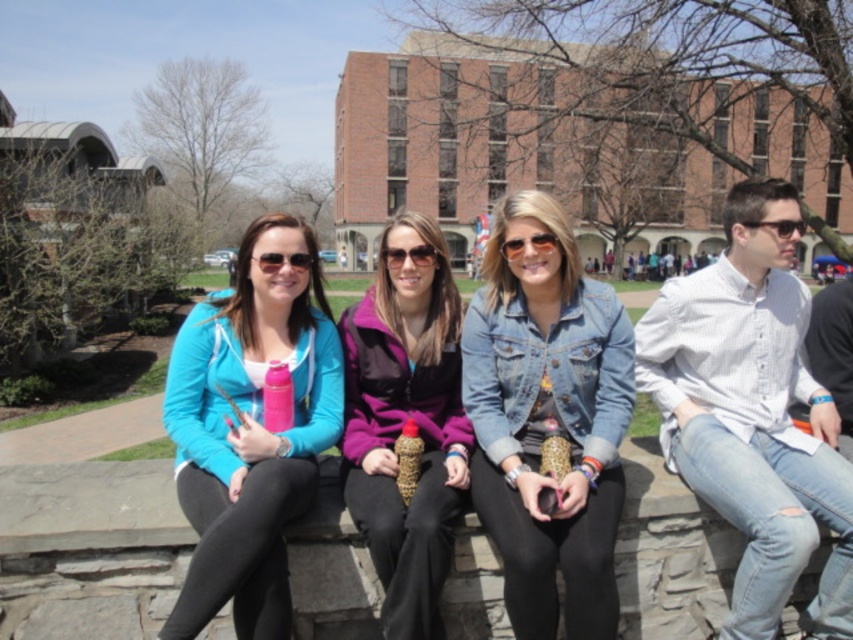
Question: Is denim jacket at center to the right of matte purple sunglasses at center from the viewer's perspective?

Choices:
 (A) yes
 (B) no

Answer: (A)

Question: Which object is positioned farthest from the white striped shirt at right?

Choices:
 (A) denim jacket at center
 (B) matte purple sunglasses at center

Answer: (B)

Question: Which of the following is the closest to the observer?

Choices:
 (A) matte purple sunglasses at center
 (B) purple fleece jacket at center
 (C) white striped shirt at right

Answer: (C)

Question: Which of the following is the closest to the observer?

Choices:
 (A) denim jacket at center
 (B) white striped shirt at right
 (C) matte purple sunglasses at center

Answer: (B)

Question: From the image, what is the correct spatial relationship of matte blue jacket at center in relation to matte purple sunglasses at center?

Choices:
 (A) right
 (B) left

Answer: (B)

Question: Where is denim jacket at center located in relation to matte purple sunglasses at center in the image?

Choices:
 (A) left
 (B) right

Answer: (B)